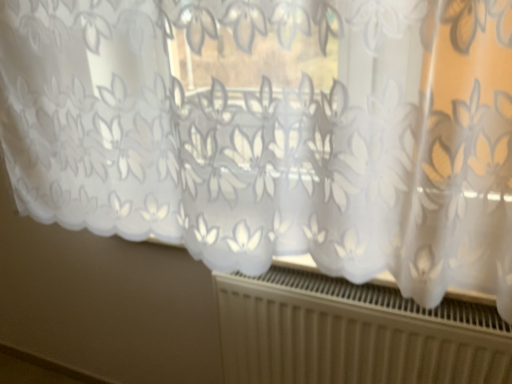
This screenshot has height=384, width=512. Describe the element at coordinates (353, 333) in the screenshot. I see `beige metallic radiator at lower center` at that location.

In the scene shown: In order to face beige metallic radiator at lower center, should I rotate leftwards or rightwards?

You should rotate right by 12.615 degrees.

This screenshot has width=512, height=384. Identify the location of beige metallic radiator at lower center. (353, 333).

At what (x,y) coordinates should I click in order to perform the action: click on beige metallic radiator at lower center. Please return your answer as a coordinate pair (x, y). This screenshot has height=384, width=512. Looking at the image, I should click on (353, 333).